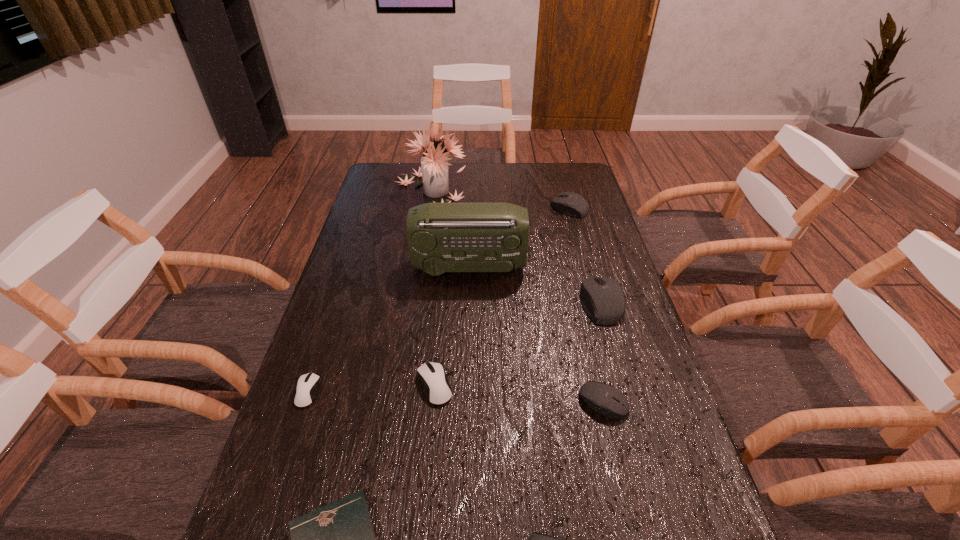
Find the location of `the tallest object`. the tallest object is located at coordinates click(434, 166).

In order to click on bouquet in this screenshot , I will do `click(434, 166)`.

Locate an element on the screen. the second tallest object is located at coordinates (443, 238).

Find the location of `the tallest computer equipment`. the tallest computer equipment is located at coordinates (603, 299).

Identify the location of the biggest black computer equipment. point(603,299).

Locate an element on the screen. The image size is (960, 540). the third smallest black computer equipment is located at coordinates (569, 203).

Image resolution: width=960 pixels, height=540 pixels. Find the location of `the farthest black computer equipment`. the farthest black computer equipment is located at coordinates tap(569, 203).

Identify the location of the second computer equipment from left to right. The height and width of the screenshot is (540, 960). (437, 389).

The image size is (960, 540). In order to click on the right white mouse in this screenshot , I will do `click(437, 389)`.

Where is `the second smallest black computer equipment`? The image size is (960, 540). the second smallest black computer equipment is located at coordinates (608, 401).